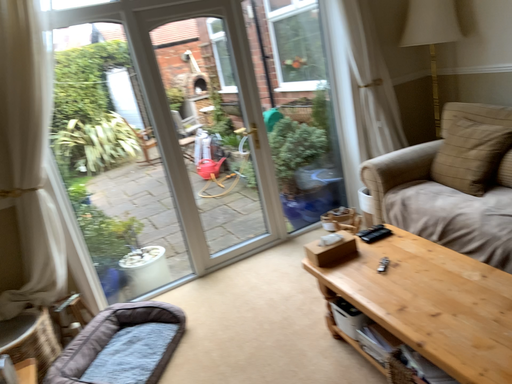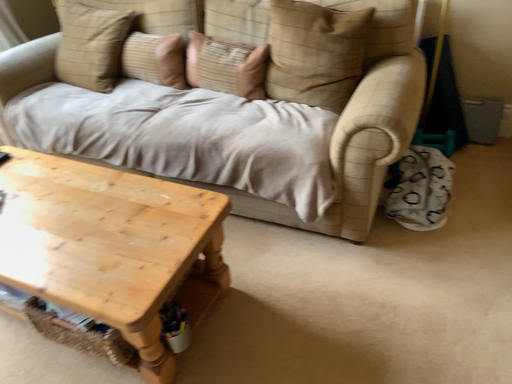
Question: Which way did the camera rotate in the video?

Choices:
 (A) rotated upward
 (B) rotated downward

Answer: (B)